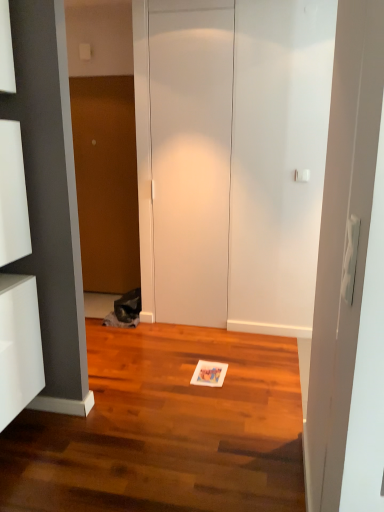
Question: From the image's perspective, does white glossy cabinet at left appear higher than white matte door at center, acting as the 1th door starting from the front?

Choices:
 (A) yes
 (B) no

Answer: (B)

Question: Is white glossy cabinet at left facing away from white matte door at center, the 1th door when ordered from right to left?

Choices:
 (A) no
 (B) yes

Answer: (A)

Question: Could you tell me if white glossy cabinet at left is facing white matte door at center, the 2th door when ordered from back to front?

Choices:
 (A) yes
 (B) no

Answer: (B)

Question: Can you confirm if white glossy cabinet at left is bigger than white matte door at center, acting as the 1th door starting from the front?

Choices:
 (A) no
 (B) yes

Answer: (A)

Question: From a real-world perspective, is white glossy cabinet at left over white matte door at center, which appears as the 2th door when viewed from the left?

Choices:
 (A) no
 (B) yes

Answer: (A)

Question: Looking at the image, does white glossy cabinet at left seem bigger or smaller compared to white matte door at center, the 2th door when ordered from back to front?

Choices:
 (A) small
 (B) big

Answer: (A)

Question: Is white glossy cabinet at left taller or shorter than white matte door at center, which appears as the 2th door when viewed from the left?

Choices:
 (A) short
 (B) tall

Answer: (A)

Question: Considering the relative positions of white glossy cabinet at left and white matte door at center, acting as the 1th door starting from the front, in the image provided, is white glossy cabinet at left to the left or to the right of white matte door at center, acting as the 1th door starting from the front,?

Choices:
 (A) right
 (B) left

Answer: (B)

Question: From a real-world perspective, is white glossy cabinet at left positioned above or below white matte door at center, the 1th door when ordered from right to left?

Choices:
 (A) above
 (B) below

Answer: (B)

Question: Considering the relative positions of white glossy cabinet at left and wooden door at center, acting as the first door starting from the left, in the image provided, is white glossy cabinet at left to the left or to the right of wooden door at center, acting as the first door starting from the left,?

Choices:
 (A) right
 (B) left

Answer: (B)

Question: Based on their sizes in the image, would you say white glossy cabinet at left is bigger or smaller than wooden door at center, the second door when ordered from right to left?

Choices:
 (A) big
 (B) small

Answer: (B)

Question: From the image's perspective, is white glossy cabinet at left positioned above or below wooden door at center, acting as the 2th door starting from the front?

Choices:
 (A) below
 (B) above

Answer: (A)

Question: Considering the positions of point (26, 287) and point (134, 219), is point (26, 287) closer or farther from the camera than point (134, 219)?

Choices:
 (A) farther
 (B) closer

Answer: (B)

Question: From their relative heights in the image, would you say white matte door at center, which appears as the 2th door when viewed from the left, is taller or shorter than wooden door at center, placed as the first door when sorted from back to front?

Choices:
 (A) tall
 (B) short

Answer: (A)

Question: Relative to wooden door at center, acting as the first door starting from the left, is white matte door at center, acting as the 1th door starting from the front, in front or behind?

Choices:
 (A) front
 (B) behind

Answer: (A)